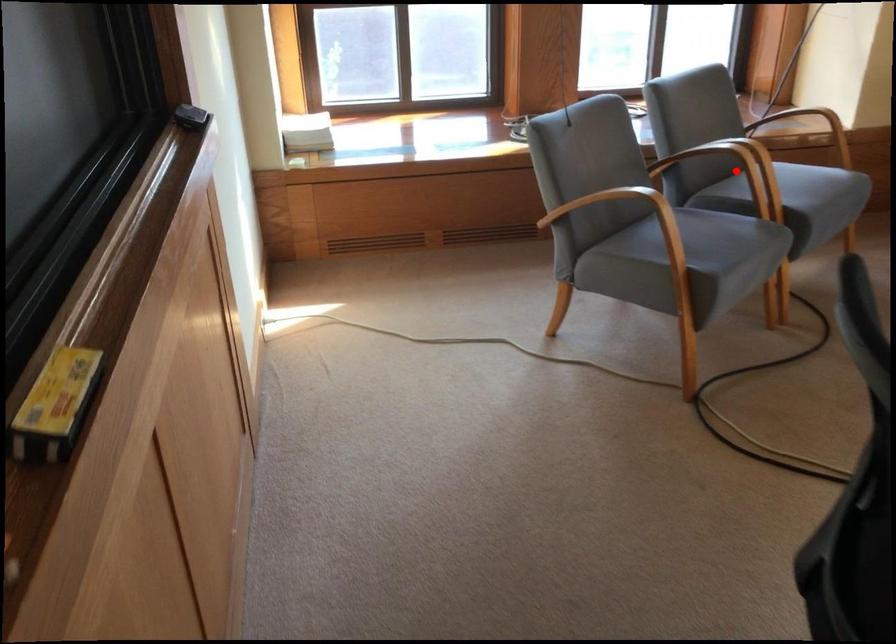
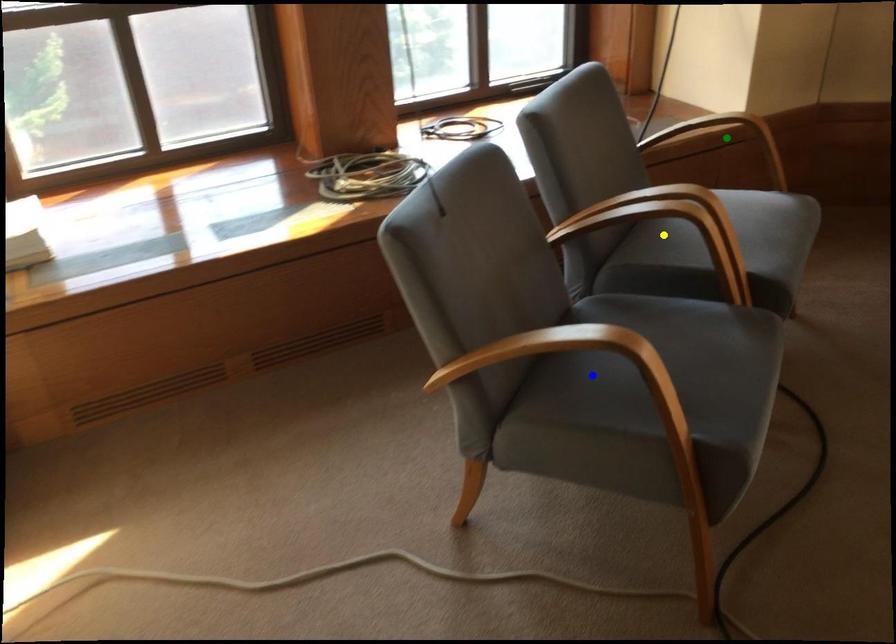
Question: I am providing you with two images of the same scene from different viewpoints. A red point is marked on the first image. You are given multiple points on the second image. In image 2, which mark is for the same physical point as the one in image 1?

Choices:
 (A) blue point
 (B) green point
 (C) yellow point

Answer: (C)